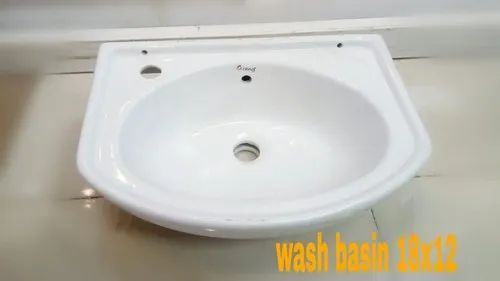
Image resolution: width=500 pixels, height=281 pixels. Identify the location of sink. (163, 112).